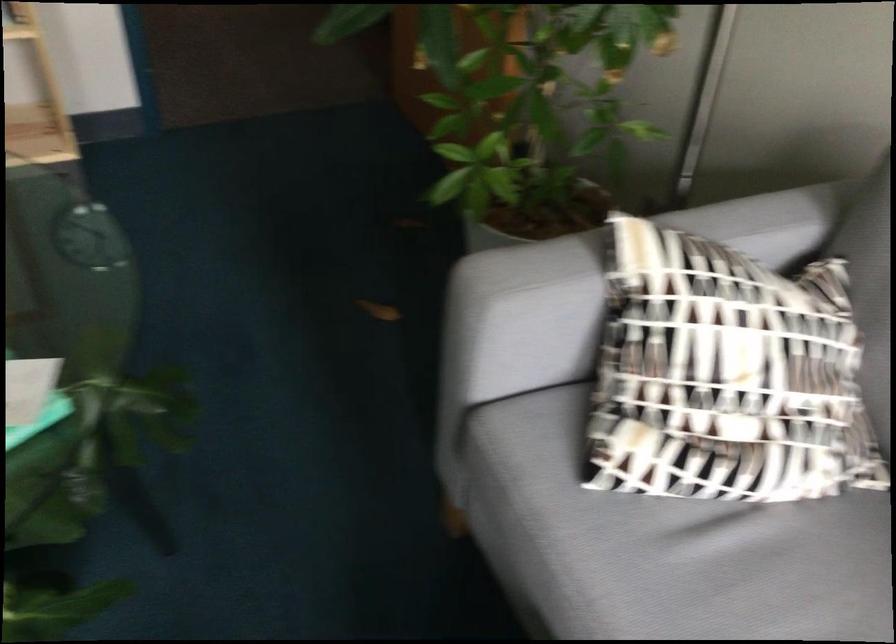
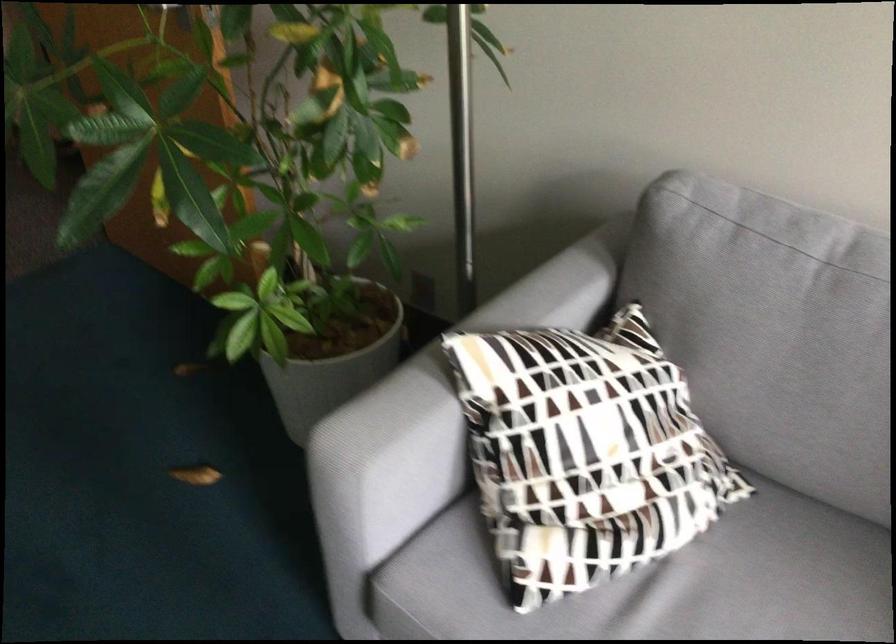
Question: I am providing you with two images of the same scene from different viewpoints. Please identify which objects are invisible in image2.

Choices:
 (A) sofa sitting surface
 (B) sofa armrest
 (C) white plant pot
 (D) none of these

Answer: (D)